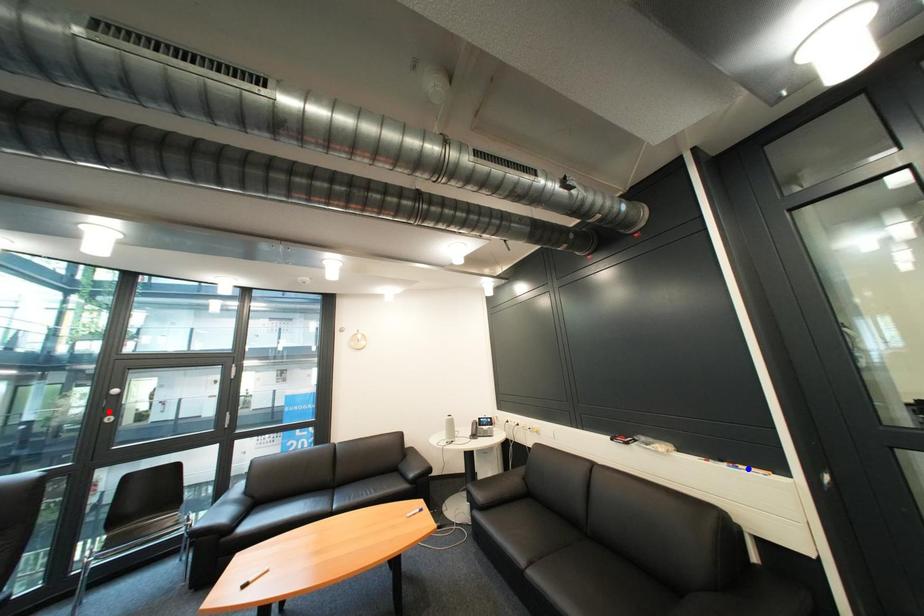
Question: In the image, two points are highlighted. Which point is nearer to the camera? Reply with the corresponding letter.

Choices:
 (A) blue point
 (B) red point

Answer: (A)